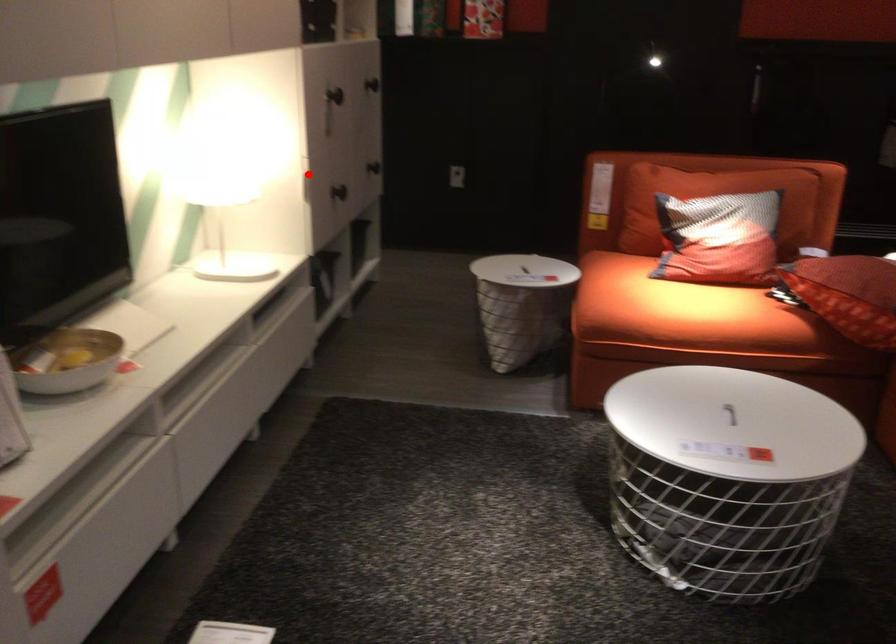
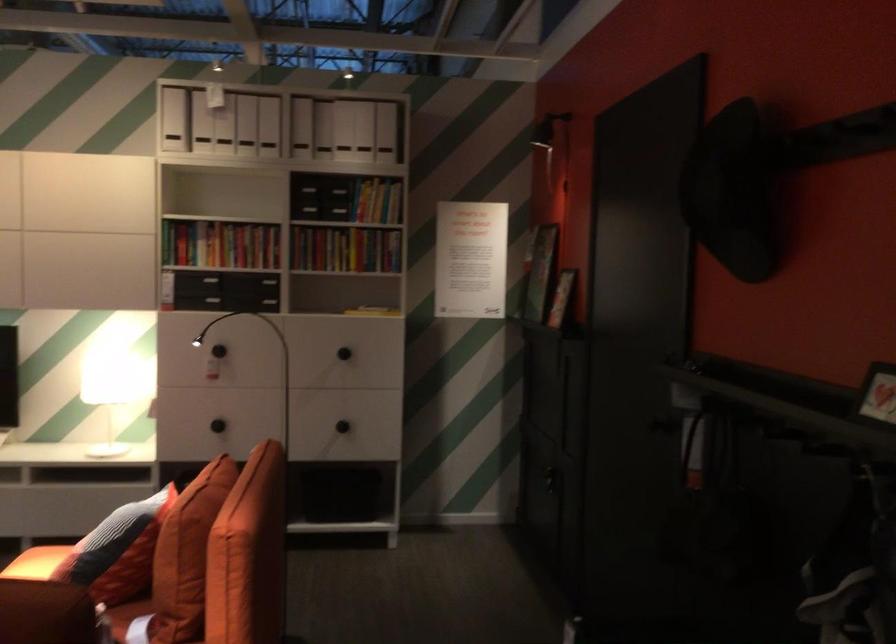
Question: I am providing you with two images of the same scene from different viewpoints. Image1 has a red point marked. In image2, the corresponding 3D location appears at what relative position? Reply with the corresponding letter.

Choices:
 (A) Closer
 (B) Farther

Answer: (B)